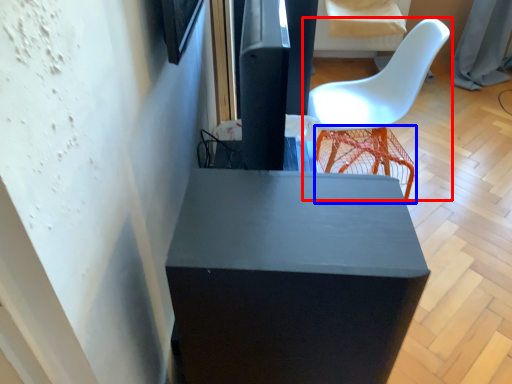
Question: Which point is further to the camera, chair (highlighted by a red box) or bar stool (highlighted by a blue box)?

Choices:
 (A) chair
 (B) bar stool

Answer: (B)